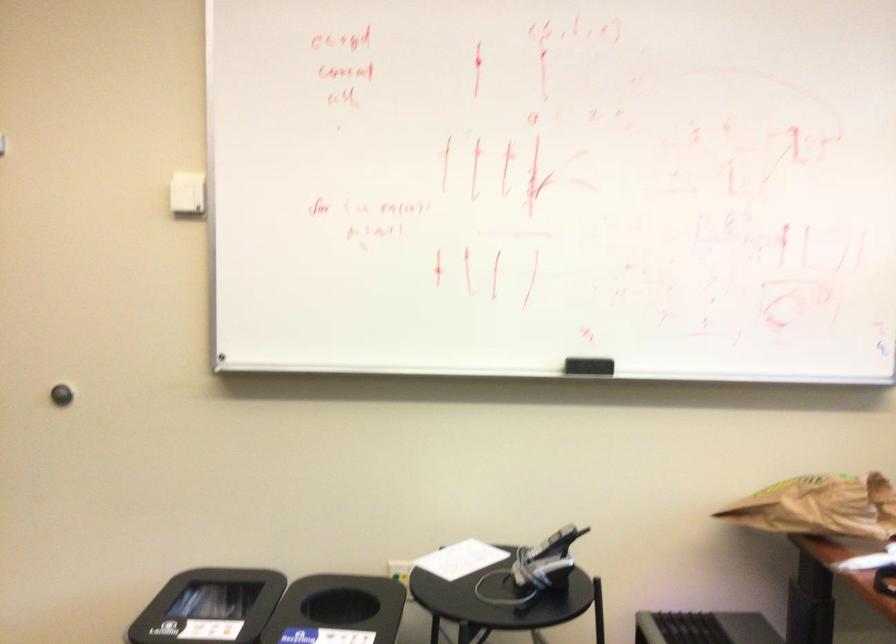
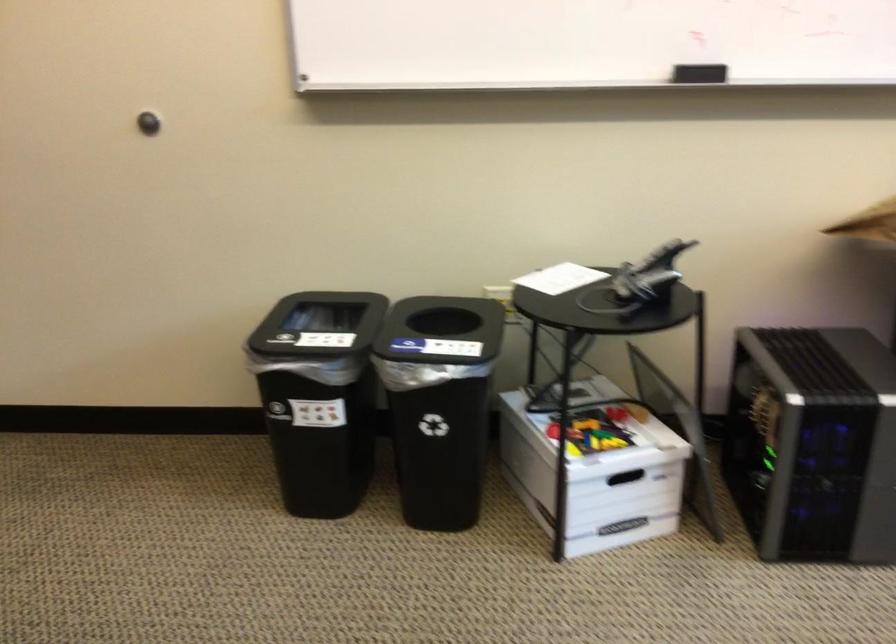
The images are taken continuously from a first-person perspective. In which direction are you moving?

The cameraman moved toward left, forward.